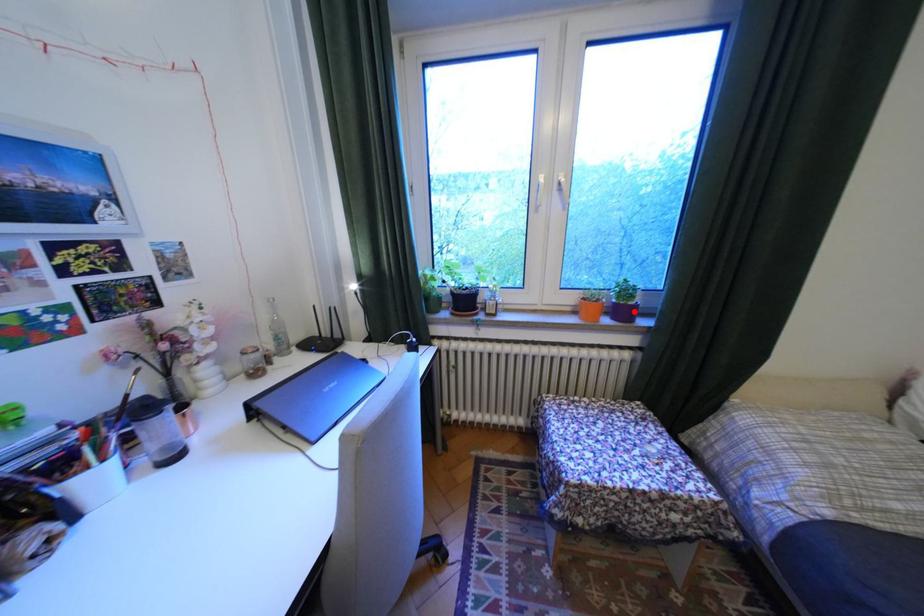
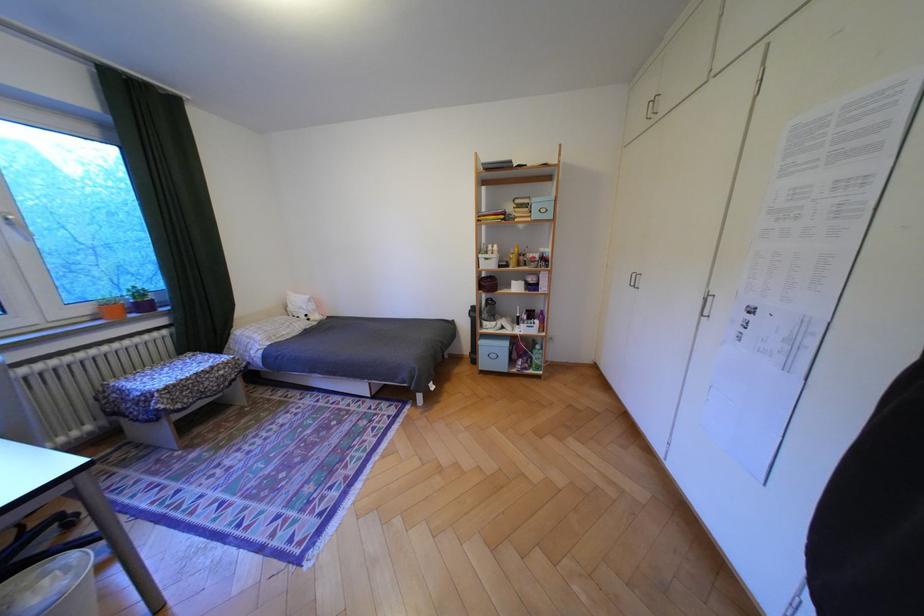
In the second image, find the point that corresponds to the highlighted location in the first image.

(155, 307)